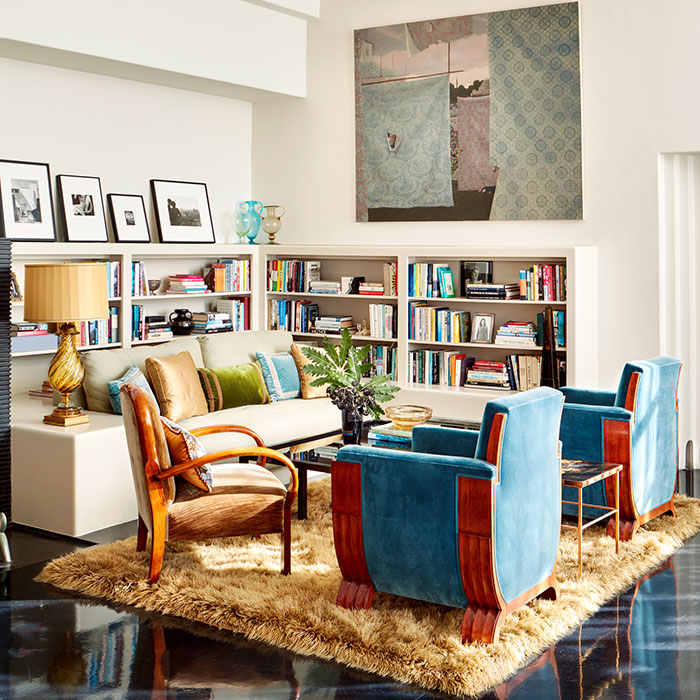
At what (x,y) coordinates should I click in order to perform the action: click on shelves. Please return your answer as a coordinate pair (x, y). The width and height of the screenshot is (700, 700). Looking at the image, I should click on (336, 312), (337, 273), (372, 360), (484, 368), (456, 326), (178, 315), (176, 276), (113, 276), (108, 330).